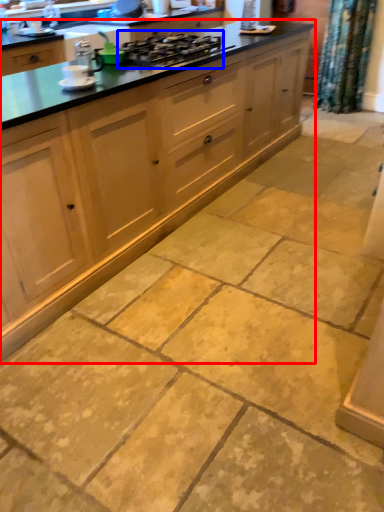
Question: Which object appears closest to the camera in this image, cabinetry (highlighted by a red box) or gas stove (highlighted by a blue box)?

Choices:
 (A) cabinetry
 (B) gas stove

Answer: (A)